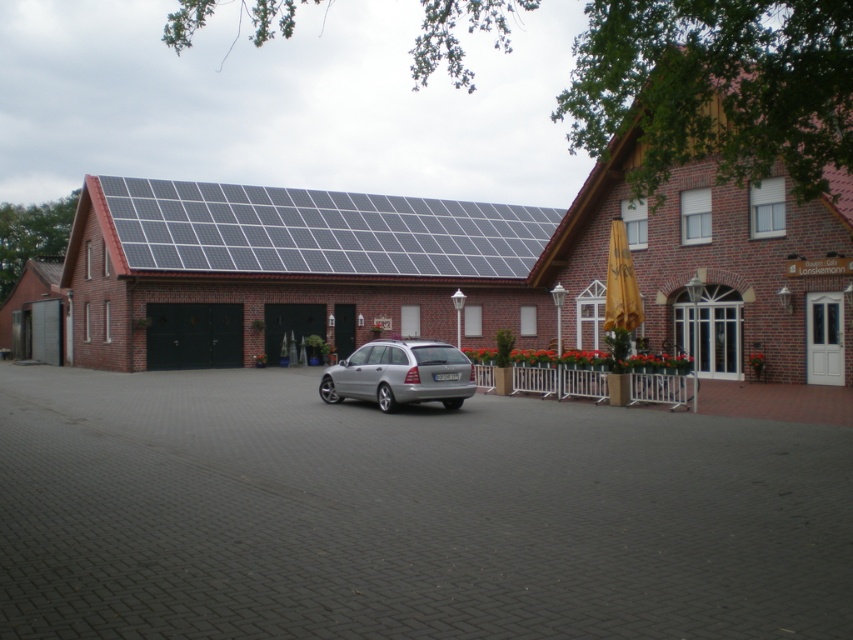
Is point (201, 572) more distant than point (194, 182)?

No.

Is gray brick driveway at center above black solar panels at upper center?

Actually, gray brick driveway at center is below black solar panels at upper center.

Describe the element at coordinates (405, 515) in the screenshot. I see `gray brick driveway at center` at that location.

Find the location of a particular element. The height and width of the screenshot is (640, 853). gray brick driveway at center is located at coordinates (405, 515).

Does black solar panels at upper center appear on the left side of silver metallic station wagon at center?

Indeed, black solar panels at upper center is positioned on the left side of silver metallic station wagon at center.

Which of these two, black solar panels at upper center or silver metallic station wagon at center, stands shorter?

silver metallic station wagon at center is shorter.

What do you see at coordinates (318, 230) in the screenshot?
I see `black solar panels at upper center` at bounding box center [318, 230].

You are a GUI agent. You are given a task and a screenshot of the screen. Output one action in this format:
    pyautogui.click(x=<x>, y=<y>)
    Task: Click on the black solar panels at upper center
    
    Given the screenshot: What is the action you would take?
    pyautogui.click(x=318, y=230)

Which is below, gray brick driveway at center or brown shingles at upper right?

gray brick driveway at center

Which is more to the right, gray brick driveway at center or brown shingles at upper right?

brown shingles at upper right

Which is in front, point (96, 563) or point (839, 138)?

Positioned in front is point (96, 563).

Identify the location of gray brick driveway at center. The image size is (853, 640). (405, 515).